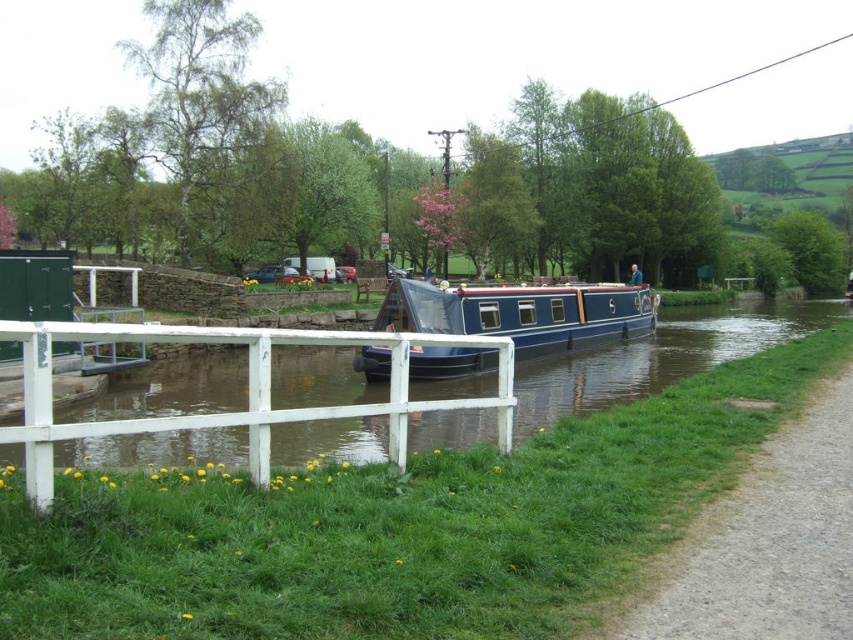
You are a delivery person carrying a package that requires a path 20 feet wide to navigate. You see the white wooden fence at lower left and the blue polished wood barge at center. Can you pass through the space between them?

The distance between the white wooden fence at lower left and the blue polished wood barge at center is 18.11 feet, which is narrower than the required 20 feet. Therefore, you cannot pass through the space between them with your package.

You are a gardener planning to place a new bench along the canal. The bench is 1.5 meters wide. You have two options for placement near the white wooden fence at lower left and the blue polished wood barge at center. Which location would allow the bench to fit without overlapping either object?

The white wooden fence at lower left has a larger width than the blue polished wood barge at center. Since the bench is 1.5 meters wide, it should be placed near the white wooden fence at lower left as it has more space available compared to the blue polished wood barge at center.